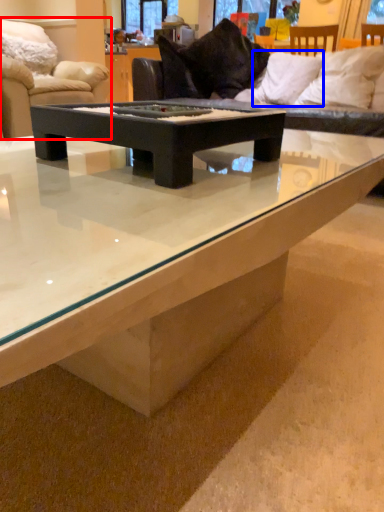
Question: Which of the following is the closest to the observer, studio couch (highlighted by a red box) or pillow (highlighted by a blue box)?

Choices:
 (A) studio couch
 (B) pillow

Answer: (B)